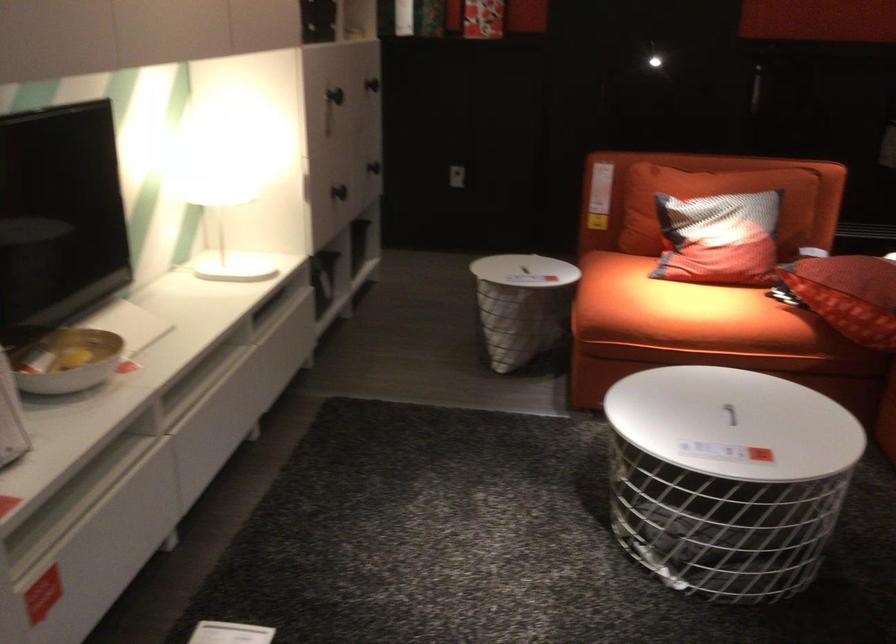
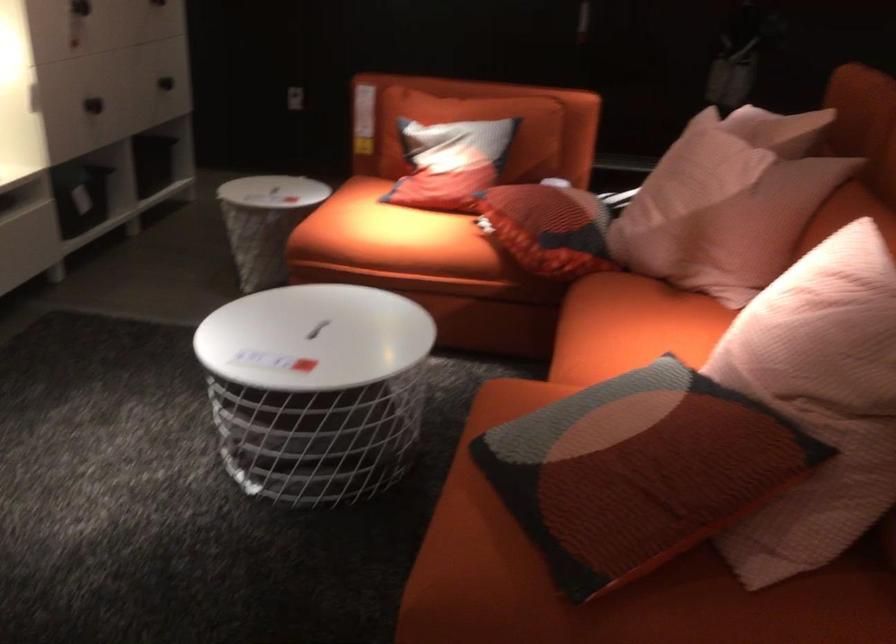
Question: The images are taken continuously from a first-person perspective. In which direction is your viewpoint rotating?

Choices:
 (A) Left
 (B) Right
 (C) Up
 (D) Down

Answer: (D)